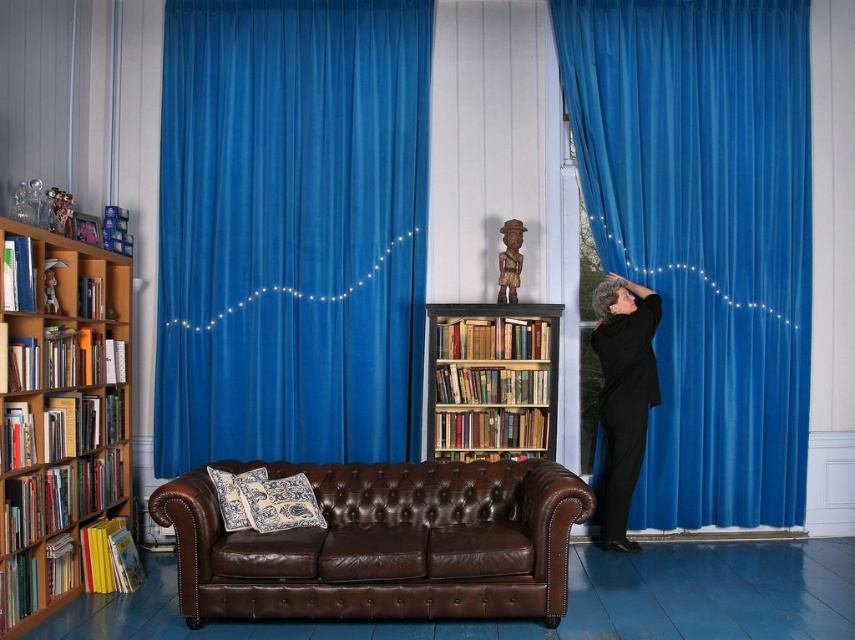
Question: Which point is farther from the camera taking this photo?

Choices:
 (A) [473, 515]
 (B) [528, 429]

Answer: (B)

Question: Estimate the real-world distances between objects in this image. Which object is farther from the brown leather couch at center?

Choices:
 (A) wooden bookcase at left
 (B) velvet blue curtain at right
 (C) wooden bookcase at center
 (D) blue velvet curtain at center

Answer: (B)

Question: Which point appears farthest from the camera in this image?

Choices:
 (A) (723, 112)
 (B) (523, 371)
 (C) (568, 484)
 (D) (81, 355)

Answer: (A)

Question: Does brown leather couch at center appear under wooden bookcase at left?

Choices:
 (A) yes
 (B) no

Answer: (A)

Question: Does velvet blue curtain at right appear on the left side of wooden bookcase at center?

Choices:
 (A) no
 (B) yes

Answer: (A)

Question: Is velvet blue curtain at right to the right of wooden bookcase at center from the viewer's perspective?

Choices:
 (A) no
 (B) yes

Answer: (B)